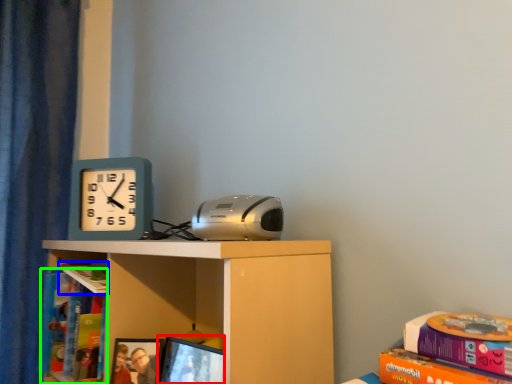
Question: Which object is positioned closest to computer screen (highlighted by a red box)? Select from book (highlighted by a blue box) and book (highlighted by a green box).

Choices:
 (A) book
 (B) book

Answer: (A)